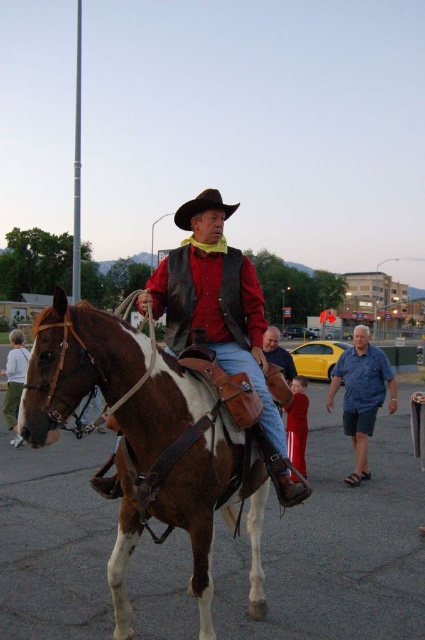
Is blue cotton shirt at center wider than blue denim shirt at center?

Correct, the width of blue cotton shirt at center exceeds that of blue denim shirt at center.

What do you see at coordinates (362, 394) in the screenshot? I see `blue cotton shirt at center` at bounding box center [362, 394].

Where is `blue cotton shirt at center`? The width and height of the screenshot is (425, 640). blue cotton shirt at center is located at coordinates (362, 394).

Is point (19, 340) behind point (187, 216)?

Yes, point (19, 340) is farther from viewer.

Which is in front, point (20, 440) or point (184, 225)?

Point (184, 225) is in front.

This screenshot has height=640, width=425. Identify the location of light gray sweater at lower left. (14, 381).

Does brown leather horse at center have a greater width compared to brown leather cowboy hat at center?

Incorrect, brown leather horse at center's width does not surpass brown leather cowboy hat at center's.

Which of these two, brown leather horse at center or brown leather cowboy hat at center, stands taller?

brown leather cowboy hat at center is taller.

Between point (125, 545) and point (178, 209), which one is positioned in front?

Point (125, 545)

Find the location of a particular element. brown leather horse at center is located at coordinates (147, 442).